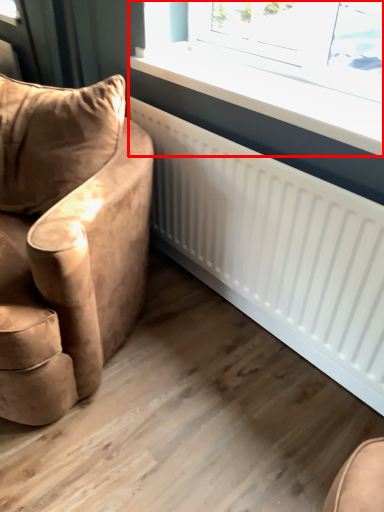
Question: From the image's perspective, considering the relative positions of window (annotated by the red box) and chair in the image provided, where is window (annotated by the red box) located with respect to the staircase?

Choices:
 (A) below
 (B) above

Answer: (B)